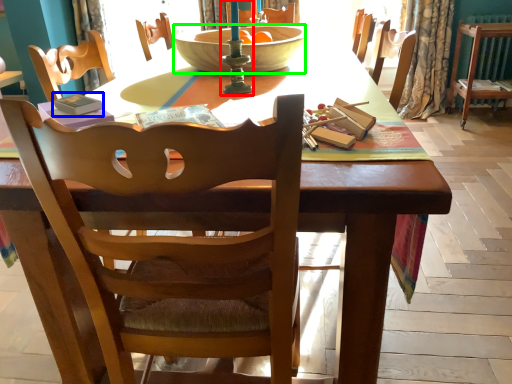
Question: Considering the real-world distances, which object is closest to candle holder (highlighted by a red box)? paperback book (highlighted by a blue box) or bowl (highlighted by a green box).

Choices:
 (A) paperback book
 (B) bowl

Answer: (B)